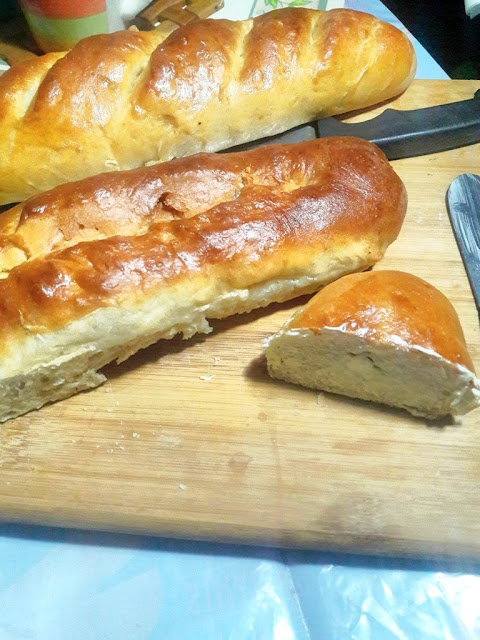
This screenshot has width=480, height=640. I want to click on edge of chopping board, so click(210, 532).